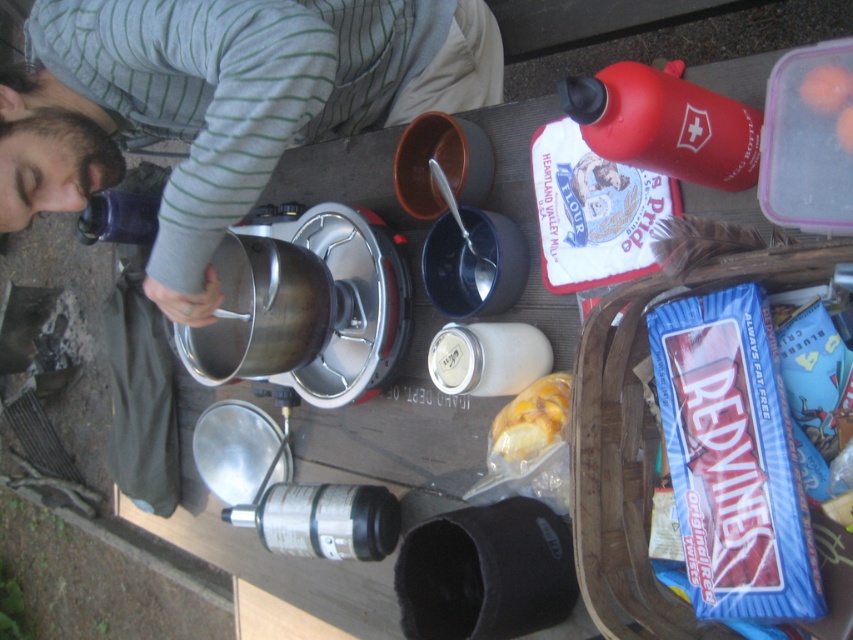
Is point (733, 125) positioned in front of point (817, 88)?

No, it is behind (817, 88).

Identify the location of red matte water bottle at upper right. (665, 124).

From the picture: Who is positioned more to the right, translucent plastic bag at center or transparent plastic bottle at upper left?

Positioned to the right is translucent plastic bag at center.

Does translucent plastic bag at center have a larger size compared to transparent plastic bottle at upper left?

Incorrect, translucent plastic bag at center is not larger than transparent plastic bottle at upper left.

Which is behind, point (502, 417) or point (148, 227)?

Positioned behind is point (148, 227).

Locate an element on the screen. Image resolution: width=853 pixels, height=640 pixels. translucent plastic bag at center is located at coordinates (531, 419).

Is point (80, 33) farther from viewer compared to point (720, 125)?

Yes, point (80, 33) is behind point (720, 125).

Identify the location of gray striped shirt at upper left. The width and height of the screenshot is (853, 640). (221, 104).

Describe the element at coordinates (221, 104) in the screenshot. This screenshot has width=853, height=640. I see `gray striped shirt at upper left` at that location.

You are a GUI agent. You are given a task and a screenshot of the screen. Output one action in this format:
    pyautogui.click(x=<x>, y=<y>)
    Task: Click on the gray striped shirt at upper left
    
    Given the screenshot: What is the action you would take?
    pyautogui.click(x=221, y=104)